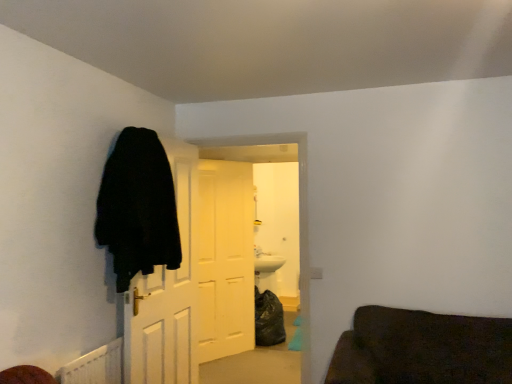
Question: In which direction should I rotate to look at white matte door at center, marked as the 3th door in a front-to-back arrangement?

Choices:
 (A) left
 (B) right

Answer: (A)

Question: Considering the relative positions of black matte door at left, the third door positioned from the back, and white wooden door at center, which is counted as the second door, starting from the front, in the image provided, is black matte door at left, the third door positioned from the back, to the right of white wooden door at center, which is counted as the second door, starting from the front, from the viewer's perspective?

Choices:
 (A) no
 (B) yes

Answer: (A)

Question: From a real-world perspective, is black matte door at left, the third door positioned from the back, positioned over white wooden door at center, which is counted as the second door, starting from the front, based on gravity?

Choices:
 (A) yes
 (B) no

Answer: (B)

Question: Considering the relative positions of black matte door at left, the 1th door in the front-to-back sequence, and white wooden door at center, which is the second door from back to front, in the image provided, is black matte door at left, the 1th door in the front-to-back sequence, behind white wooden door at center, which is the second door from back to front,?

Choices:
 (A) no
 (B) yes

Answer: (A)

Question: Are black matte door at left, the 1th door in the front-to-back sequence, and white wooden door at center, which is the second door from back to front, located far from each other?

Choices:
 (A) no
 (B) yes

Answer: (A)

Question: Is black matte door at left, the third door positioned from the back, looking in the opposite direction of white wooden door at center, which is counted as the second door, starting from the front?

Choices:
 (A) yes
 (B) no

Answer: (B)

Question: Is white wooden door at center, which is counted as the second door, starting from the front, a part of black matte door at left, the third door positioned from the back?

Choices:
 (A) no
 (B) yes

Answer: (A)

Question: Does white matte door at center, acting as the 1th door starting from the back, have a lesser width compared to black fuzzy coat at left?

Choices:
 (A) no
 (B) yes

Answer: (B)

Question: Is the position of white matte door at center, acting as the 1th door starting from the back, less distant than that of black fuzzy coat at left?

Choices:
 (A) no
 (B) yes

Answer: (A)

Question: Is white matte door at center, marked as the 3th door in a front-to-back arrangement, behind black fuzzy coat at left?

Choices:
 (A) yes
 (B) no

Answer: (A)

Question: Considering the relative sizes of white matte door at center, acting as the 1th door starting from the back, and black fuzzy coat at left in the image provided, is white matte door at center, acting as the 1th door starting from the back, taller than black fuzzy coat at left?

Choices:
 (A) yes
 (B) no

Answer: (A)

Question: Is white matte door at center, acting as the 1th door starting from the back, looking in the opposite direction of black fuzzy coat at left?

Choices:
 (A) no
 (B) yes

Answer: (A)

Question: From a real-world perspective, is white matte door at center, marked as the 3th door in a front-to-back arrangement, positioned under black fuzzy coat at left based on gravity?

Choices:
 (A) no
 (B) yes

Answer: (B)

Question: Is white matte door at center, marked as the 3th door in a front-to-back arrangement, to the left of black matte door at left, the 1th door in the front-to-back sequence, from the viewer's perspective?

Choices:
 (A) no
 (B) yes

Answer: (A)